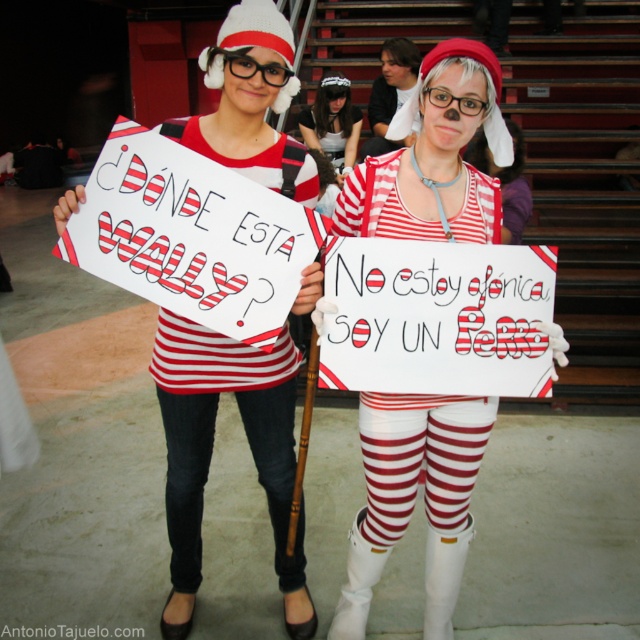
Question: Does white matte striped shirt at center have a lesser width compared to white fabric headband at center?

Choices:
 (A) no
 (B) yes

Answer: (A)

Question: Which of the following is the farthest from the observer?

Choices:
 (A) white matte striped shirt at center
 (B) white fabric headband at center

Answer: (B)

Question: Can you confirm if white matte striped shirt at center is wider than white fabric headband at center?

Choices:
 (A) yes
 (B) no

Answer: (A)

Question: Can you confirm if white matte striped shirt at center is thinner than white fabric headband at center?

Choices:
 (A) no
 (B) yes

Answer: (A)